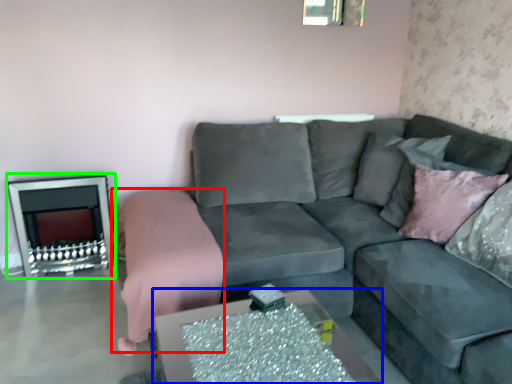
Question: Considering the real-world distances, which object is closest to bedding (highlighted by a red box)? table (highlighted by a blue box) or fireplace (highlighted by a green box).

Choices:
 (A) table
 (B) fireplace

Answer: (B)